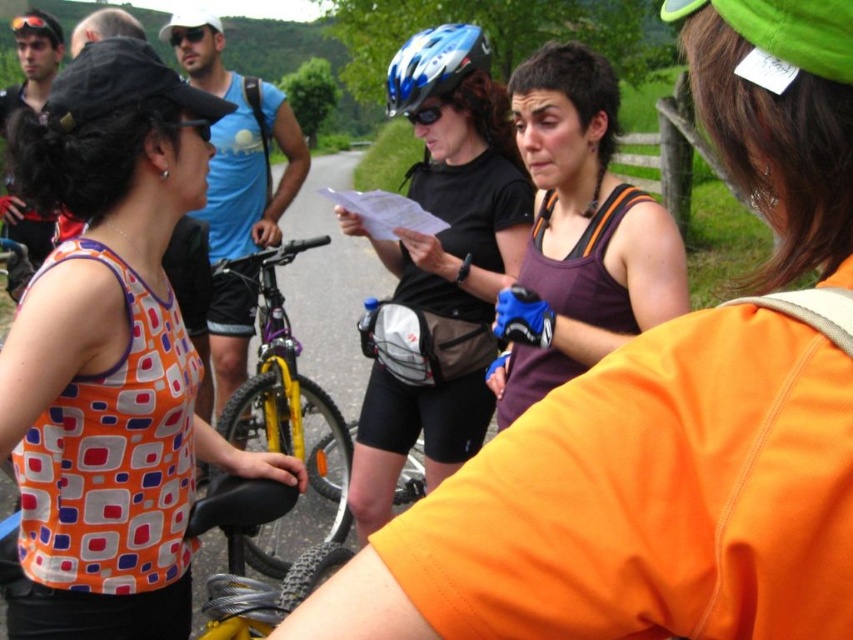
You are a photographer trying to capture a clear shot of the orange printed tank top at left and the blue glossy bicycle helmet at center. Since you want to focus on the smaller object, which one should you adjust your camera settings for?

The blue glossy bicycle helmet at center is smaller than the orange printed tank top at left, so you should adjust your camera settings to focus on the blue glossy bicycle helmet at center.

In the scene shown: You are a photographer standing at the center of the scene. You want to take a photo that includes both the orange printed tank top at left and the blue glossy bicycle helmet at center. What is the minimum distance you need to move backward to ensure both objects are fully visible in your photo?

The orange printed tank top at left and blue glossy bicycle helmet at center are 1.30 meters apart. To capture both in the frame, you need to move backward until the distance between them fits within your camera lens field of view. However, without knowing the camera sensor size and focal length, an exact distance cannot be calculated. But based on typical smartphone cameras, moving back about 2 meters should suffice to include both objects separated by 1.30 meters within the frame.